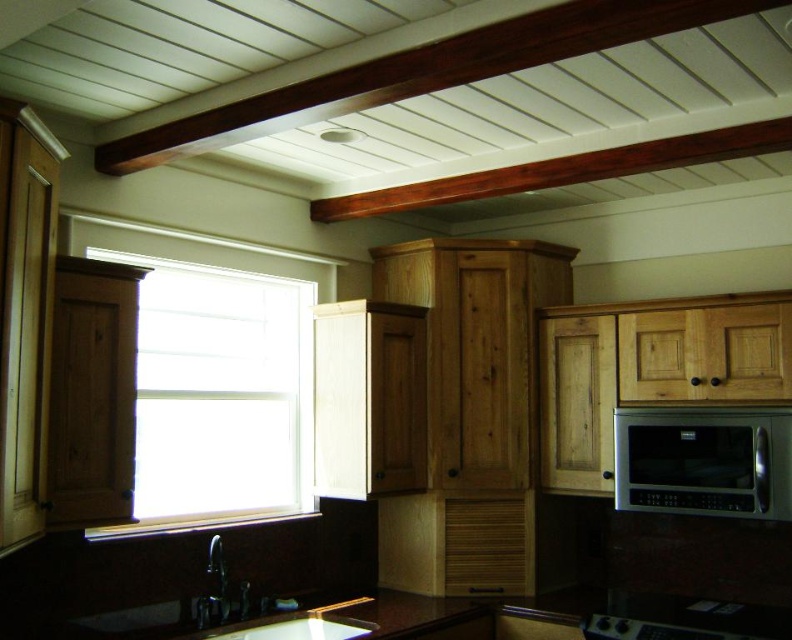
Question: Does white matte window at center appear over satin silver microwave at upper right?

Choices:
 (A) yes
 (B) no

Answer: (A)

Question: Can you confirm if white matte window at center is bigger than satin silver microwave at upper right?

Choices:
 (A) yes
 (B) no

Answer: (A)

Question: Which object appears farthest from the camera in this image?

Choices:
 (A) satin silver microwave at upper right
 (B) white matte window at center

Answer: (A)

Question: Does white matte window at center appear on the right side of satin silver microwave at upper right?

Choices:
 (A) no
 (B) yes

Answer: (A)

Question: Which point is farther to the camera?

Choices:
 (A) satin silver microwave at upper right
 (B) white matte window at center

Answer: (A)